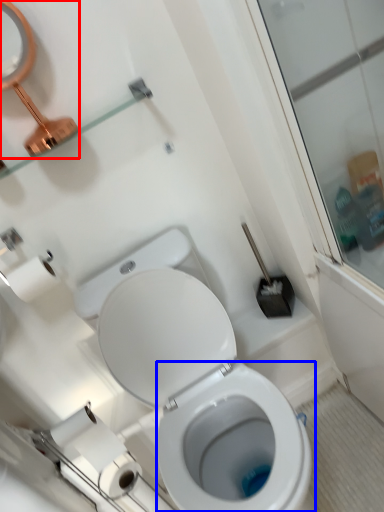
Question: Which object appears closest to the camera in this image, mirror (highlighted by a red box) or bidet (highlighted by a blue box)?

Choices:
 (A) mirror
 (B) bidet

Answer: (A)